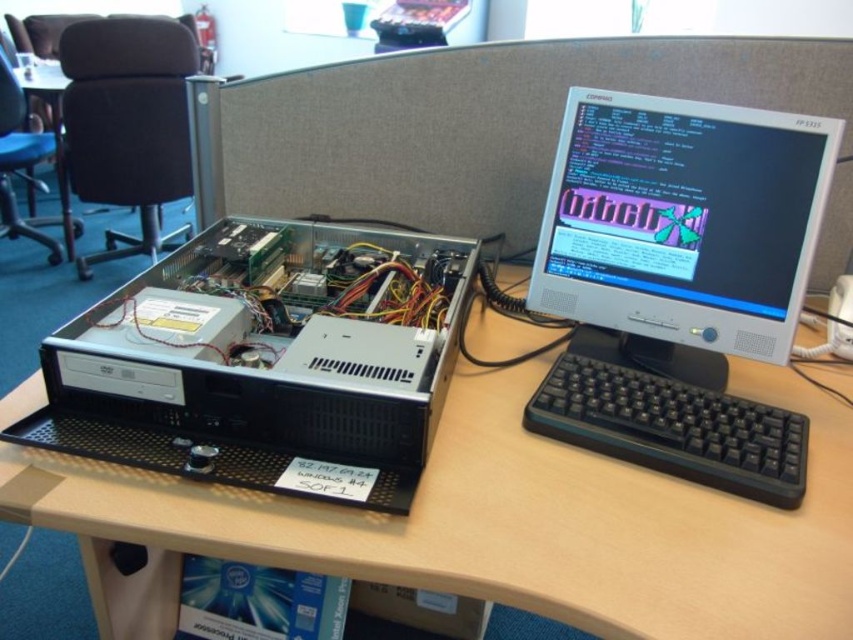
You are setting up a new monitor and need to place it on the black plastic computer desk at center. However, the monitor requires a space that is as tall as the silver metallic computer case at left. Will the desk provide enough height for the monitor?

The black plastic computer desk at center has a greater height compared to the silver metallic computer case at left, so the desk is tall enough to accommodate the monitor requiring the height of the silver metallic computer case at left.

You are standing at the point closest to the CRT monitor in the workspace. Which point, point [56,371] or point [64,211], is closer to you?

Point [56,371] is closer to you because it is in front of point [64,211].

You are organizing cables in a workspace. You need to unplug a cable connected to the silver metallic computer case at left without disturbing the black plastic keyboard at lower right. Is this possible?

The silver metallic computer case at left is in front of the black plastic keyboard at lower right, so you can unplug the cable from the silver metallic computer case at left without moving the black plastic keyboard at lower right.